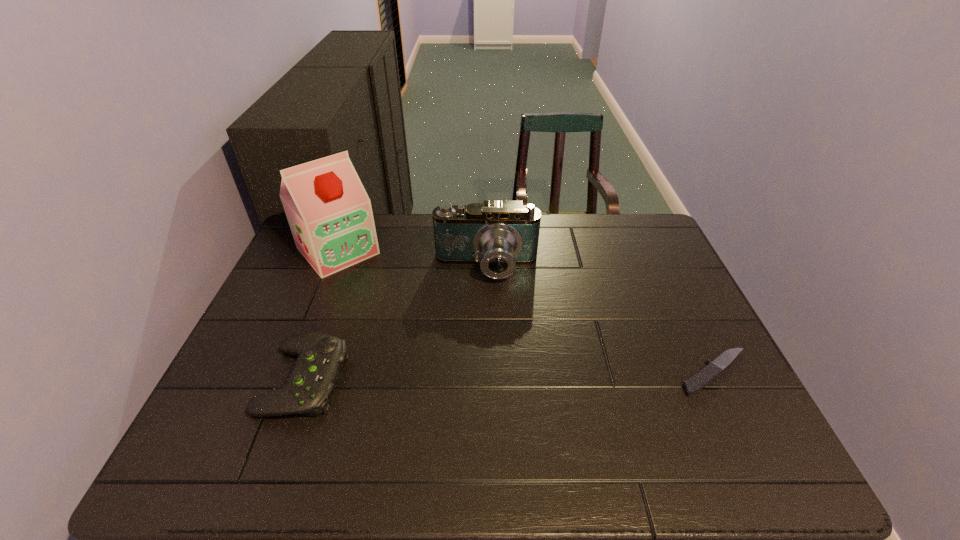
This screenshot has width=960, height=540. I want to click on vacant space on the desktop that is between the control and the shortest object and is positioned with the cap open on the tallest object, so click(454, 377).

At what (x,y) coordinates should I click in order to perform the action: click on free space on the desktop that is between the control and the shortest object and is positioned on the front-facing side of the camcorder. Please return your answer as a coordinate pair (x, y). The height and width of the screenshot is (540, 960). Looking at the image, I should click on coord(484,377).